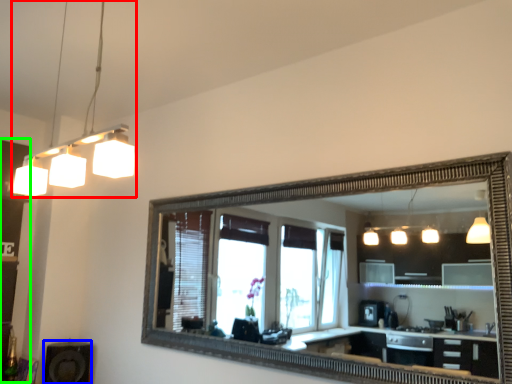
Question: Which object is positioned closest to light fixture (highlighted by a red box)? Select from speaker (highlighted by a blue box) and dresser (highlighted by a green box).

Choices:
 (A) speaker
 (B) dresser

Answer: (B)